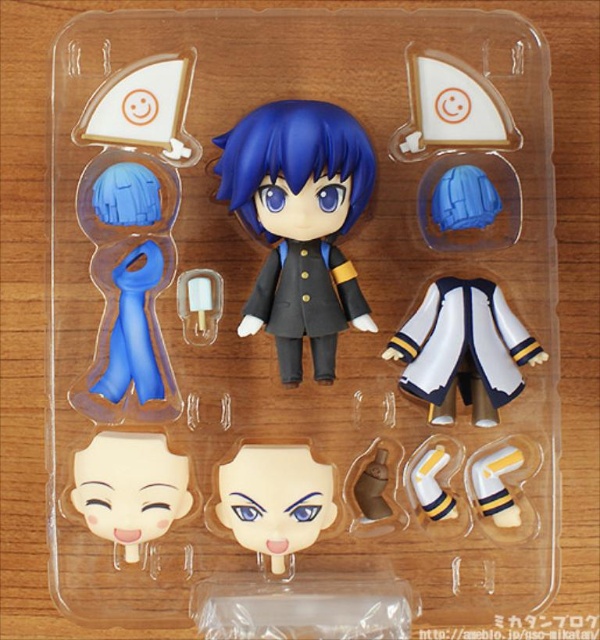
Which of these two, matte black figure at center or white matte face at center, stands shorter?

Standing shorter between the two is white matte face at center.

Does matte black figure at center come in front of white matte face at center?

Yes.

Where is `matte black figure at center`? matte black figure at center is located at coordinates [300, 221].

Looking at this image, can you confirm if matte blue scarf at left is wider than smooth beige face at center?

No.

Can you confirm if matte blue scarf at left is thinner than smooth beige face at center?

Yes, matte blue scarf at left is thinner than smooth beige face at center.

Is point (154, 180) farther from viewer compared to point (304, 536)?

Yes, it is.

The height and width of the screenshot is (640, 600). In order to click on matte blue scarf at left in this screenshot , I will do `click(133, 230)`.

Image resolution: width=600 pixels, height=640 pixels. What do you see at coordinates (463, 349) in the screenshot?
I see `white matte jacket at center` at bounding box center [463, 349].

Which is below, white matte jacket at center or white matte face at center?

Positioned lower is white matte face at center.

Is point (442, 337) farther from viewer compared to point (148, 513)?

That is True.

Locate an element on the screen. white matte jacket at center is located at coordinates point(463,349).